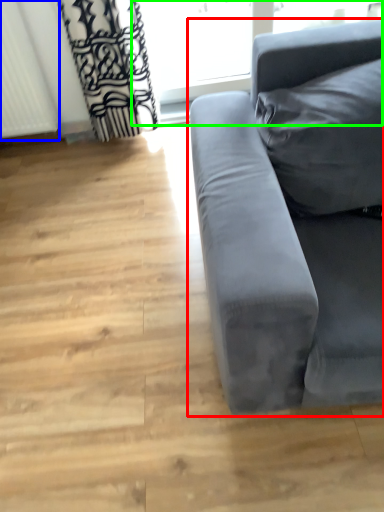
Question: Which object is the farthest from studio couch (highlighted by a red box)? Choose among these: radiator (highlighted by a blue box) or window frame (highlighted by a green box).

Choices:
 (A) radiator
 (B) window frame

Answer: (B)